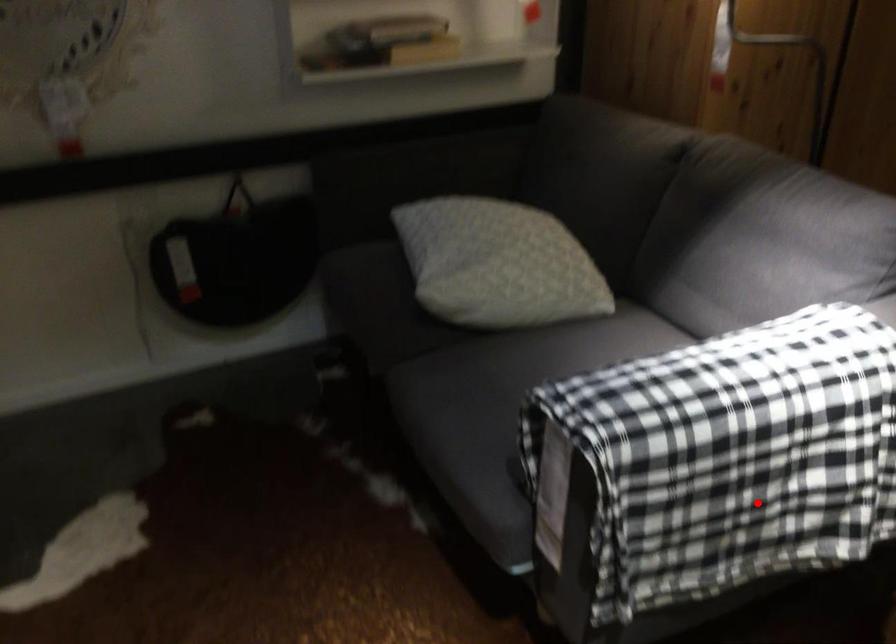
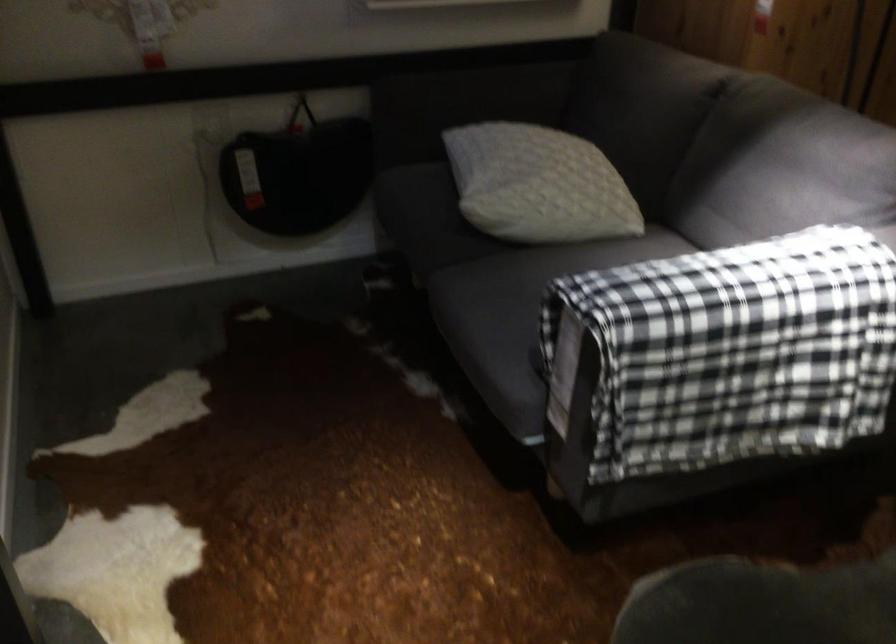
The point at the highlighted location is marked in the first image. Where is the corresponding point in the second image?

(745, 388)